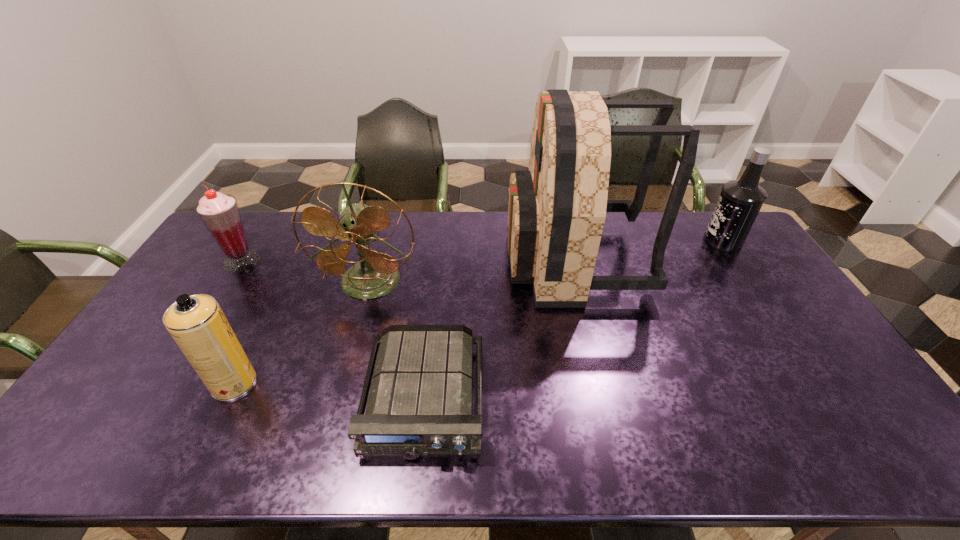
Image resolution: width=960 pixels, height=540 pixels. Identify the location of backpack. point(557,209).

You are a GUI agent. You are given a task and a screenshot of the screen. Output one action in this format:
    pyautogui.click(x=<x>, y=<y>)
    Task: Click on the fifth object from left to right
    The image size is (960, 540).
    Given the screenshot: What is the action you would take?
    pyautogui.click(x=557, y=209)

Locate an element on the screen. Image resolution: width=960 pixels, height=540 pixels. fan is located at coordinates (376, 274).

This screenshot has width=960, height=540. In order to click on the rightmost object in this screenshot , I will do `click(740, 201)`.

Locate an element on the screen. aerosol can is located at coordinates click(197, 324).

This screenshot has width=960, height=540. Find the location of `the leftmost object`. the leftmost object is located at coordinates (219, 212).

I want to click on the shortest object, so click(420, 402).

This screenshot has height=540, width=960. Find the location of `vacant space located on the front face of the second object from right to left`. vacant space located on the front face of the second object from right to left is located at coordinates (429, 260).

Find the location of a particular element. The image size is (960, 540). vacant space situated 0.170m on the front face of the second object from right to left is located at coordinates (458, 260).

The height and width of the screenshot is (540, 960). Find the location of `free region located 0.200m on the front face of the second object from right to left`. free region located 0.200m on the front face of the second object from right to left is located at coordinates [x=449, y=260].